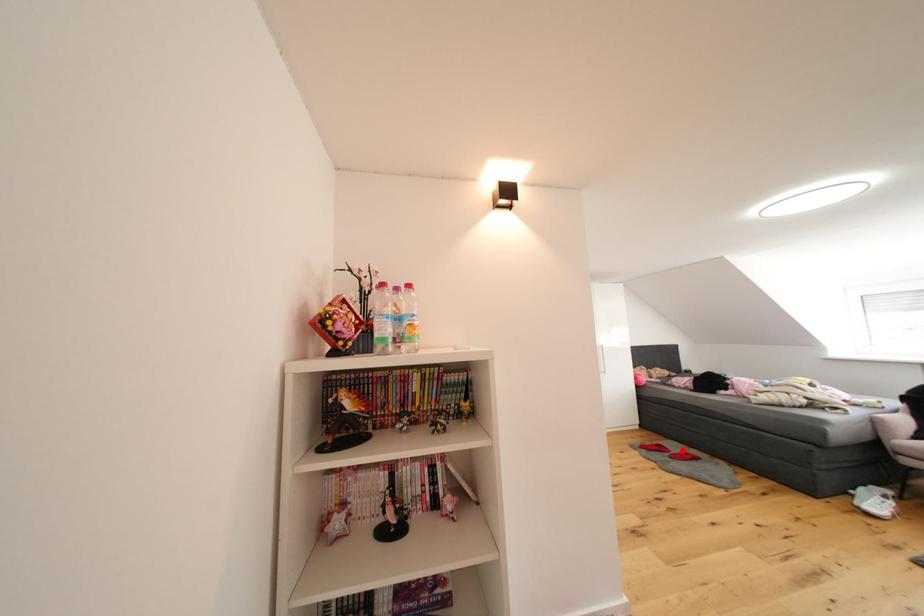
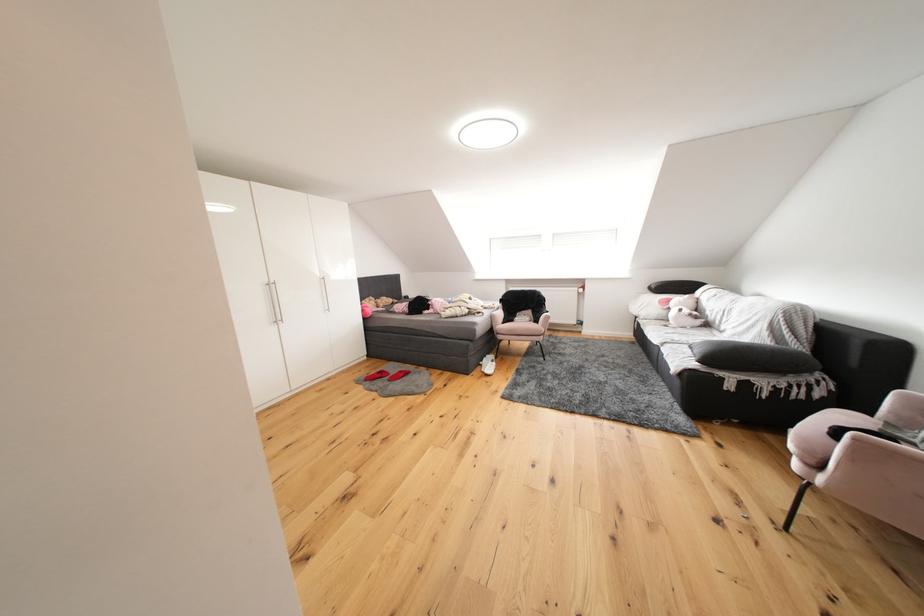
In the second image, find the point that corresponds to the highlighted location in the first image.

(402, 371)